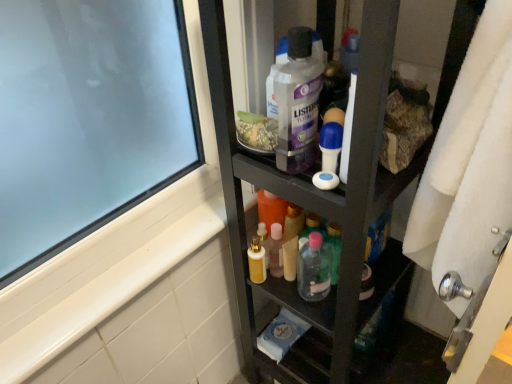
Question: Based on their positions, is white fluffy bath towel at right located to the left or right of black matte cabinet at center?

Choices:
 (A) right
 (B) left

Answer: (A)

Question: Is white fluffy bath towel at right inside the boundaries of black matte cabinet at center, or outside?

Choices:
 (A) outside
 (B) inside

Answer: (A)

Question: Which of these objects is positioned closest to the white fluffy bath towel at right?

Choices:
 (A) translucent plastic bottle at center, which appears as the second toiletry when viewed from the top
 (B) white matte soap at center
 (C) clear plastic mouthwash at center
 (D) white plastic roll-on deodorant at center, which appears as the 1th toiletry when viewed from the top
 (E) black matte cabinet at center

Answer: (D)

Question: Considering the real-world distances, which object is closest to the white plastic roll-on deodorant at center, which appears as the 1th toiletry when viewed from the top?

Choices:
 (A) white fluffy bath towel at right
 (B) clear plastic mouthwash at center
 (C) white matte soap at center
 (D) black matte cabinet at center
 (E) translucent plastic bottle at center, the second toiletry viewed from the front

Answer: (C)